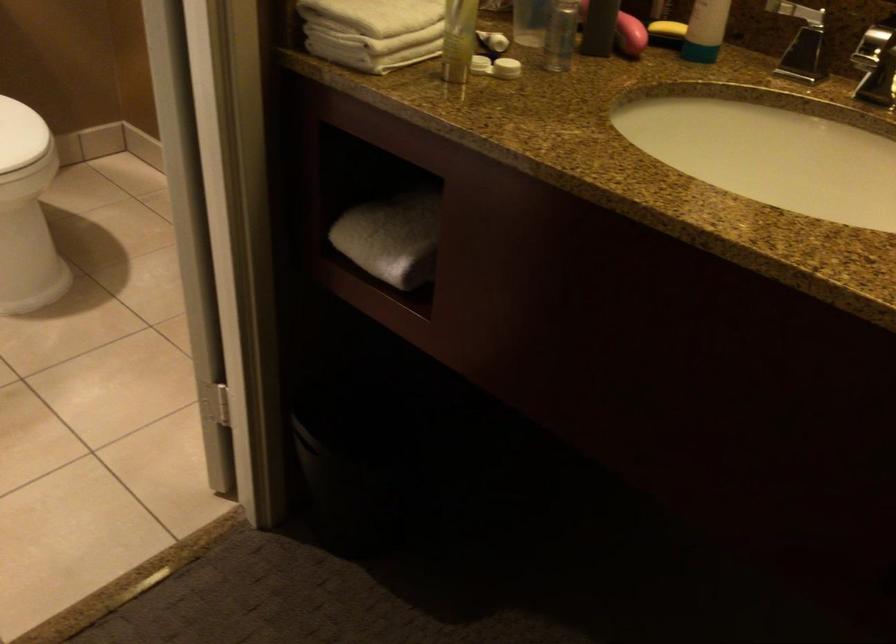
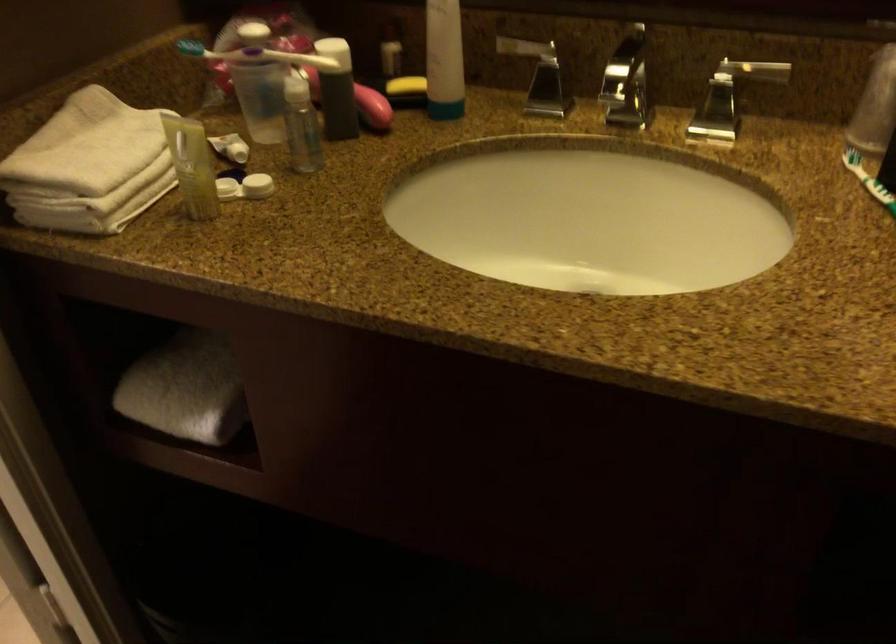
The point at (495, 67) is marked in the first image. Where is the corresponding point in the second image?

(245, 187)